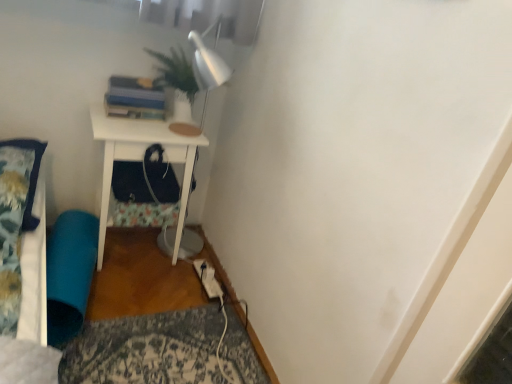
You are a GUI agent. You are given a task and a screenshot of the screen. Output one action in this format:
    pyautogui.click(x=<x>, y=<y>)
    Task: Click on the fluffy blue pillow at left
    
    Given the screenshot: What is the action you would take?
    tap(30, 176)

This screenshot has width=512, height=384. Find the location of `fluffy blue pillow at left`. fluffy blue pillow at left is located at coordinates (30, 176).

From a real-world perspective, between white matte nightstand at center and teal fabric bean bag at lower left, who is vertically lower?

teal fabric bean bag at lower left.

Is white matte nightstand at center turned away from teal fabric bean bag at lower left?

No, white matte nightstand at center is not facing away from teal fabric bean bag at lower left.

Is white matte nightstand at center spatially inside teal fabric bean bag at lower left, or outside of it?

white matte nightstand at center is spatially situated outside teal fabric bean bag at lower left.

Are fluffy blue pillow at left and teal fabric bean bag at lower left far apart?

That's not correct — fluffy blue pillow at left is a little close to teal fabric bean bag at lower left.

From the image's perspective, does fluffy blue pillow at left appear lower than teal fabric bean bag at lower left?

No, from the image's perspective, fluffy blue pillow at left is not below teal fabric bean bag at lower left.

Considering the sizes of fluffy blue pillow at left and teal fabric bean bag at lower left in the image, is fluffy blue pillow at left taller or shorter than teal fabric bean bag at lower left?

In the image, fluffy blue pillow at left appears to be shorter than teal fabric bean bag at lower left.

From a real-world perspective, between fluffy blue pillow at left and teal fabric bean bag at lower left, who is vertically lower?

From a 3D spatial view, teal fabric bean bag at lower left is below.

From the image's perspective, does white matte nightstand at center appear lower than fluffy blue pillow at left?

Indeed, from the image's perspective, white matte nightstand at center is shown beneath fluffy blue pillow at left.

From a real-world perspective, between white matte nightstand at center and fluffy blue pillow at left, who is vertically lower?

white matte nightstand at center is physically lower.

Could you tell me if white matte nightstand at center is facing fluffy blue pillow at left?

No, white matte nightstand at center does not turn towards fluffy blue pillow at left.

From the image's perspective, between teal fabric bean bag at lower left and white matte nightstand at center, who is located below?

teal fabric bean bag at lower left, from the image's perspective.

How many degrees apart are the facing directions of teal fabric bean bag at lower left and white matte nightstand at center?

There is a 82.4-degree angle between the facing directions of teal fabric bean bag at lower left and white matte nightstand at center.

Are teal fabric bean bag at lower left and white matte nightstand at center making contact?

No, teal fabric bean bag at lower left is not touching white matte nightstand at center.

Between fluffy blue pillow at left and white matte nightstand at center, which one has smaller width?

white matte nightstand at center.

Which object is further away from the camera, fluffy blue pillow at left or white matte nightstand at center?

white matte nightstand at center.

Is fluffy blue pillow at left bigger or smaller than white matte nightstand at center?

fluffy blue pillow at left is smaller than white matte nightstand at center.

Is fluffy blue pillow at left positioned with its back to white matte nightstand at center?

fluffy blue pillow at left does not have its back to white matte nightstand at center.

Locate an element on the screen. The image size is (512, 384). pillow above the teal fabric bean bag at lower left (from a real-world perspective) is located at coordinates (30, 176).

Between teal fabric bean bag at lower left and fluffy blue pillow at left, which one has larger size?

With larger size is teal fabric bean bag at lower left.

Is teal fabric bean bag at lower left facing towards fluffy blue pillow at left?

No, teal fabric bean bag at lower left is not facing towards fluffy blue pillow at left.

Is teal fabric bean bag at lower left wider or thinner than fluffy blue pillow at left?

Considering their sizes, teal fabric bean bag at lower left looks slimmer than fluffy blue pillow at left.

Find the location of a particular element. This screenshot has width=512, height=384. nightstand positioned vertically above the teal fabric bean bag at lower left (from a real-world perspective) is located at coordinates (140, 159).

Locate an element on the screen. The width and height of the screenshot is (512, 384). bean bag chair located behind the fluffy blue pillow at left is located at coordinates (69, 273).

When comparing their distances from fluffy blue pillow at left, does white matte nightstand at center or teal fabric bean bag at lower left seem further?

white matte nightstand at center.

From the image, which object appears to be nearer to fluffy blue pillow at left, teal fabric bean bag at lower left or white matte nightstand at center?

teal fabric bean bag at lower left.

Considering their positions, is fluffy blue pillow at left positioned further to white matte nightstand at center than teal fabric bean bag at lower left?

fluffy blue pillow at left lies further to white matte nightstand at center than the other object.

From the image, which object appears to be nearer to teal fabric bean bag at lower left, fluffy blue pillow at left or white matte nightstand at center?

white matte nightstand at center.

Estimate the real-world distances between objects in this image. Which object is further from teal fabric bean bag at lower left, white matte nightstand at center or fluffy blue pillow at left?

fluffy blue pillow at left is further to teal fabric bean bag at lower left.

Based on their spatial positions, is teal fabric bean bag at lower left or fluffy blue pillow at left closer to white matte nightstand at center?

The object closer to white matte nightstand at center is teal fabric bean bag at lower left.

Locate an element on the screen. This screenshot has height=384, width=512. nightstand between fluffy blue pillow at left and teal fabric bean bag at lower left in the up-down direction is located at coordinates (140, 159).